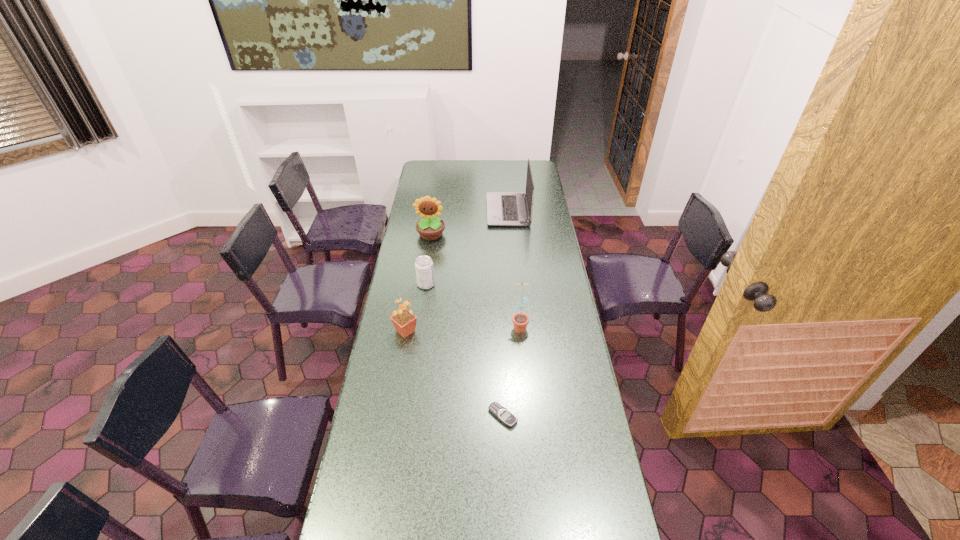
Where is `vacant region located on the face of the farthest sunflower`? This screenshot has width=960, height=540. vacant region located on the face of the farthest sunflower is located at coordinates (421, 296).

Locate an element on the screen. vacant space located 0.150m on the flower of the rightmost sunflower is located at coordinates (523, 366).

Identify the location of free space located on the back of the fifth tallest object. This screenshot has width=960, height=540. (433, 233).

At what (x,y) coordinates should I click in order to perform the action: click on vacant space located on the back of the nearest object. Please return your answer as a coordinate pair (x, y). Looking at the image, I should click on (499, 342).

Where is `soda can located in the left edge section of the desktop`? soda can located in the left edge section of the desktop is located at coordinates (424, 269).

Locate an element on the screen. This screenshot has width=960, height=540. object located at the right edge is located at coordinates (503, 208).

Locate an element on the screen. This screenshot has width=960, height=540. free region at the far edge of the desktop is located at coordinates [482, 170].

Find the location of a particular element. free point at the left edge is located at coordinates (412, 257).

This screenshot has height=540, width=960. I want to click on free space at the right edge of the desktop, so click(608, 478).

Locate an element on the screen. The height and width of the screenshot is (540, 960). free space between the fourth nearest object and the laptop computer is located at coordinates (467, 247).